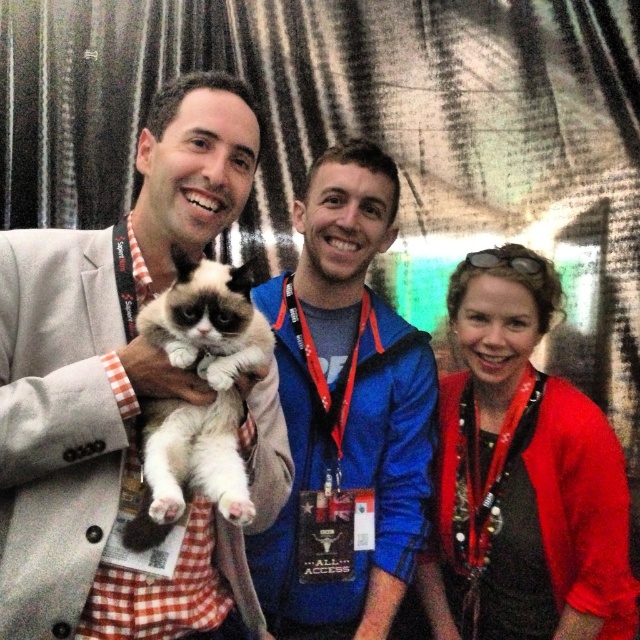
You are standing at the point marked by coordinates (109,384) in the image. Looking around, you see the light gray suit at center. Which direction should you face to see the person holding the grumpy cat?

You should face towards the left to see the person holding the grumpy cat because the light gray suit at center is located at point (109,384), which is the same as your current position, indicating you are standing at the center where the light gray suit is located. The person holding the grumpy cat is on the left side of the image.

You are a photographer at the event and need to ensure that both the light gray suit at center and the white fluffy cat at center are clearly visible in the photo. Given their size difference, which one might require more careful framing to ensure it stands out?

The white fluffy cat at center is smaller than the light gray suit at center, so it might require more careful framing to ensure it stands out.